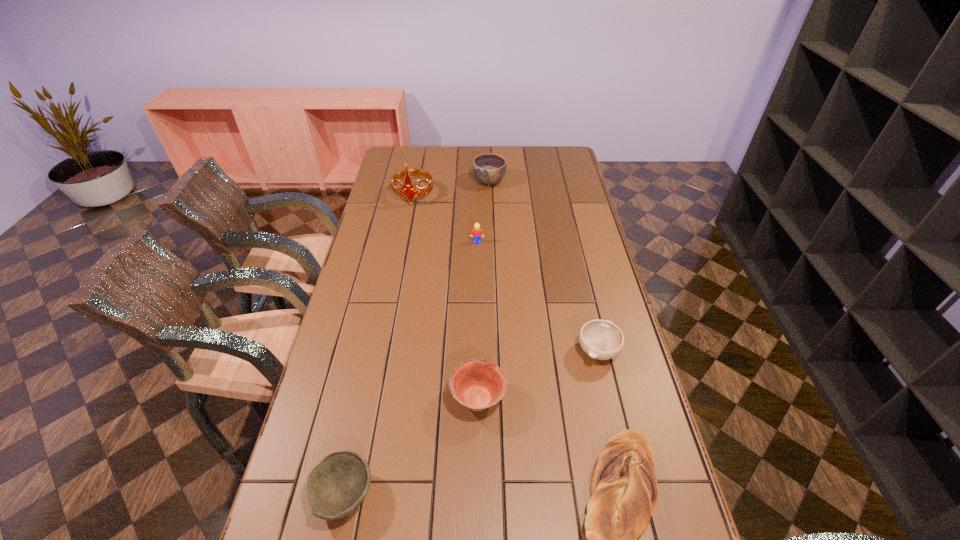
Where is `the closest bowl to the fourth farthest object`? the closest bowl to the fourth farthest object is located at coordinates (477, 384).